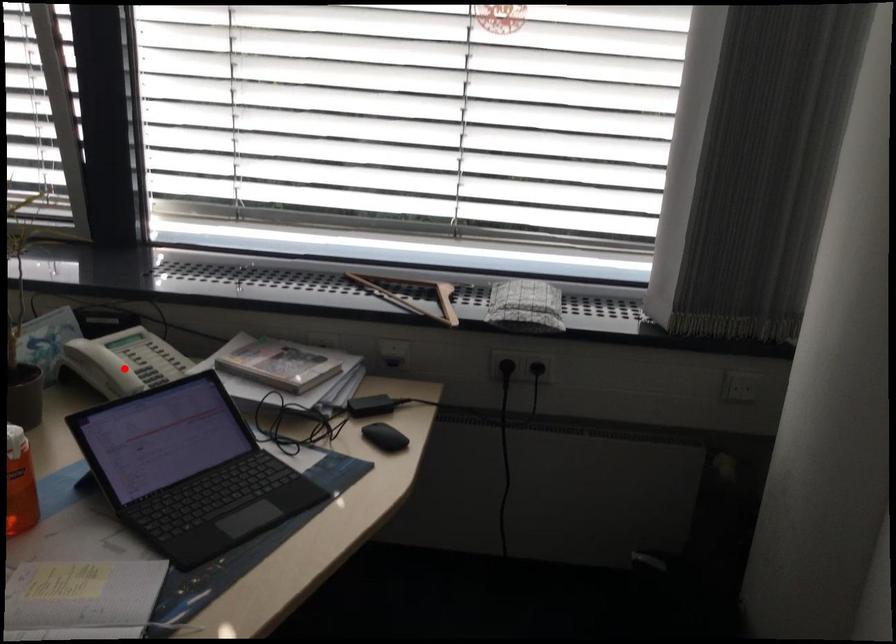
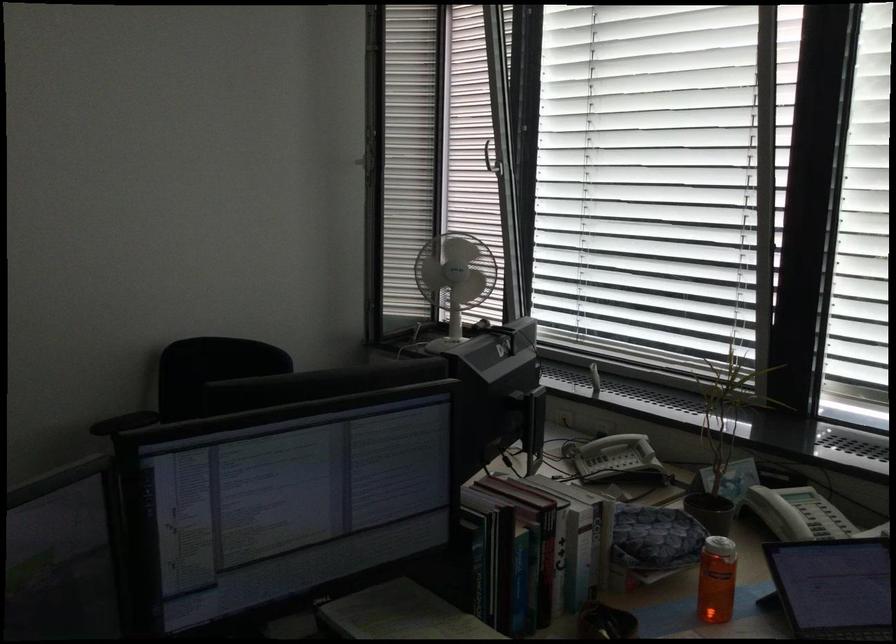
Locate, in the second image, the point that corresponds to the highlighted location in the first image.

(797, 514)